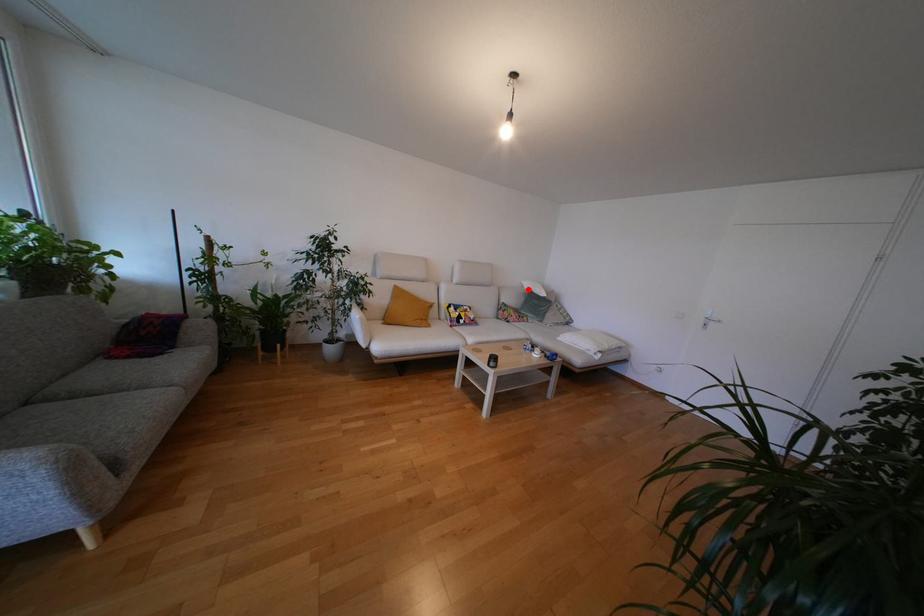
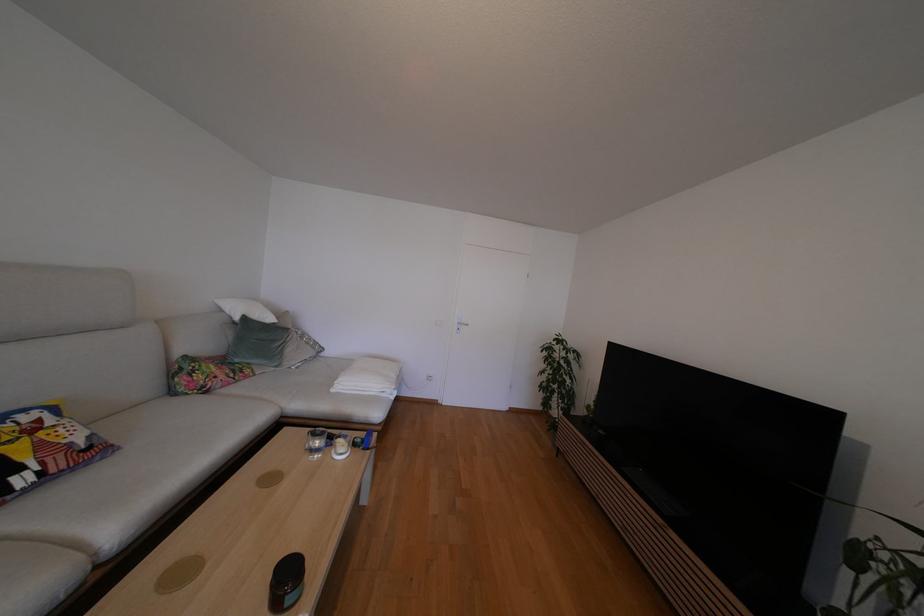
Question: I am providing you with two images of the same scene from different viewpoints. Given a red point in image1, look at the same physical point in image2. Is it:

Choices:
 (A) Closer to the viewpoint
 (B) Farther from the viewpoint

Answer: (B)